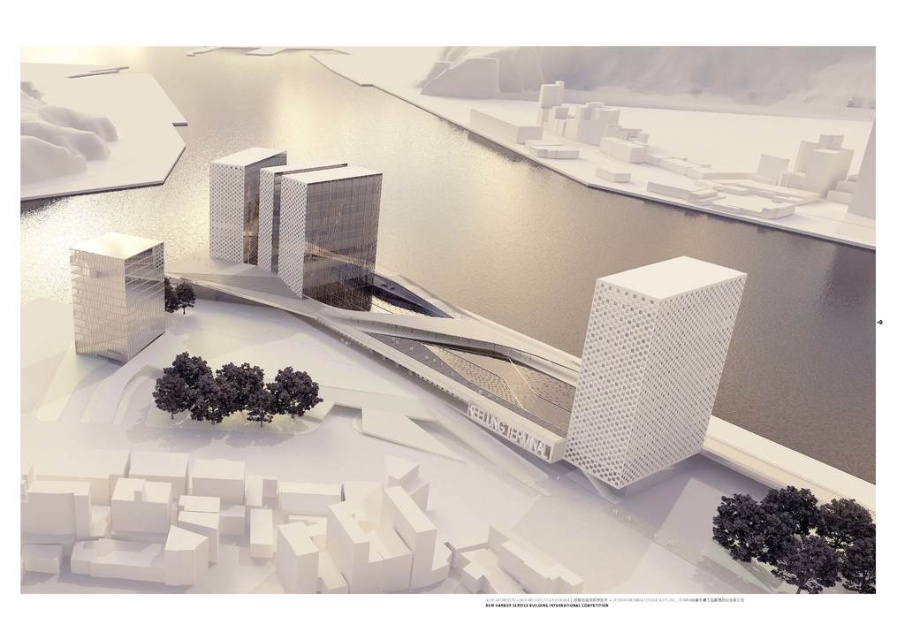
You are an architect evaluating the spatial relationship between the white textured cube at lower left and the polished glass tower at center in the futuristic waterfront design. Which structure has a greater height?

The polished glass tower at center is taller than the white textured cube at lower left.

You are an architect reviewing the design of the waterfront terminal. You notice two central towers, the metallic glass tower at center and the polished glass tower at center. According to the design, which tower is located to the right when facing the waterfront?

The metallic glass tower at center is positioned on the right side of the polished glass tower at center, so when facing the waterfront, the metallic glass tower at center would be to the right of the polished glass tower at center.